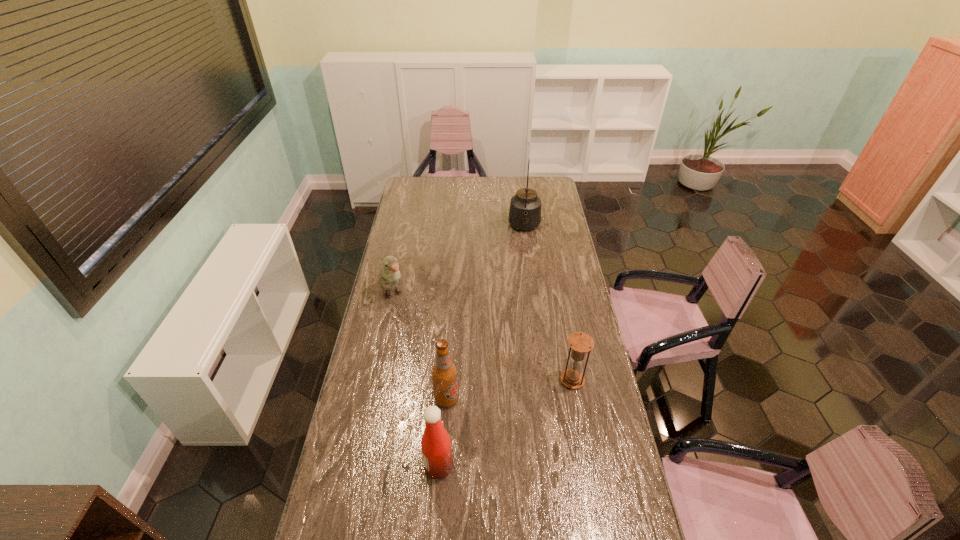
The height and width of the screenshot is (540, 960). In order to click on condiment in this screenshot , I will do `click(436, 445)`.

Where is `hourglass`? hourglass is located at coordinates (580, 343).

You are a GUI agent. You are given a task and a screenshot of the screen. Output one action in this format:
    pyautogui.click(x=<x>, y=<y>)
    Task: Click on the beer bottle
    
    Given the screenshot: What is the action you would take?
    pyautogui.click(x=444, y=372)

Find the location of a particular element. This screenshot has width=960, height=540. the tallest object is located at coordinates (525, 207).

I want to click on the farthest object, so click(x=525, y=207).

I want to click on the leftmost object, so (x=389, y=275).

Identify the location of the second farthest object. The image size is (960, 540). (389, 275).

Locate an element on the screen. free region located on the front-facing side of the condiment is located at coordinates pyautogui.click(x=406, y=466).

Identify the location of vacant space located on the front-facing side of the condiment. (388, 466).

The width and height of the screenshot is (960, 540). Find the location of `free space located on the front-facing side of the condiment`. free space located on the front-facing side of the condiment is located at coordinates (388, 466).